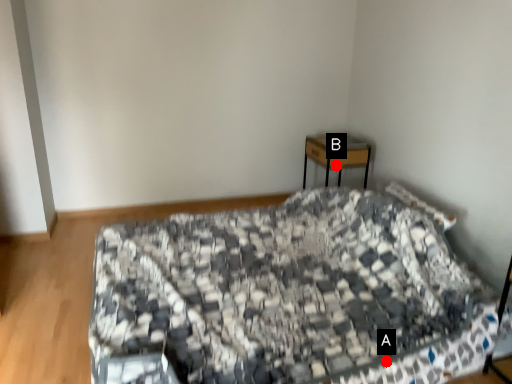
Question: Two points are circled on the image, labeled by A and B beside each circle. Which point is closer to the camera taking this photo?

Choices:
 (A) A is closer
 (B) B is closer

Answer: (A)